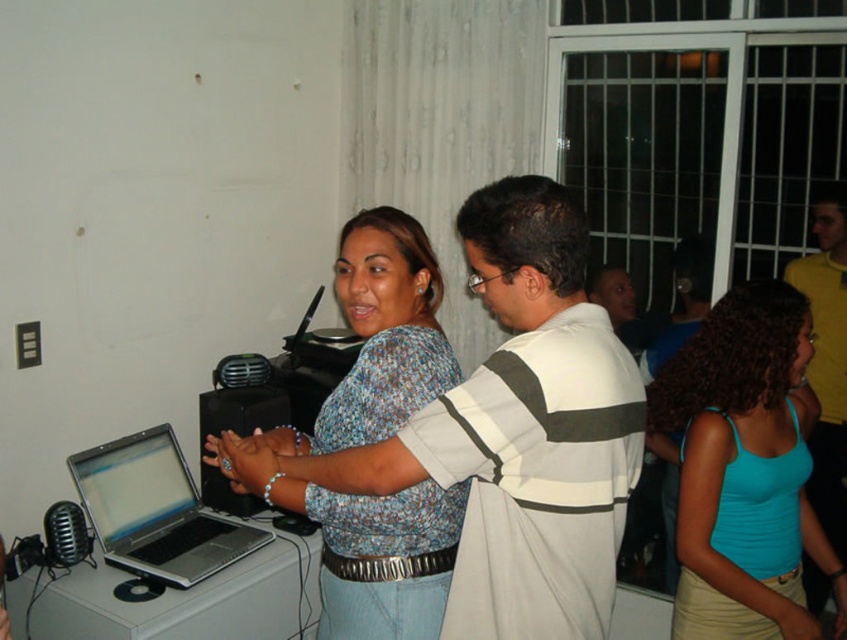
You are observing a scene where two people are standing at the center of the room. You notice a white striped shirt at center and a teal fabric tank top at center. From your perspective, which clothing item is positioned to the left?

The white striped shirt at center is positioned to the left of the teal fabric tank top at center.

You are standing in the room and see two points marked in the image. The first point is at coordinates point (530, 189) and the second point is at point (814, 381). If you want to walk from the first point to the second point, which direction should you move in relation to the points?

To move from point (530, 189) to point (814, 381), you should move towards the direction of increasing coordinates, which would be diagonally to the right and upwards since the second point has higher x and y values than the first point.